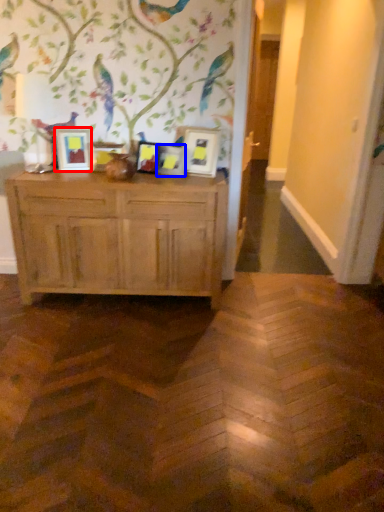
Question: Which object is further to the camera taking this photo, picture frame (highlighted by a red box) or picture frame (highlighted by a blue box)?

Choices:
 (A) picture frame
 (B) picture frame

Answer: (B)